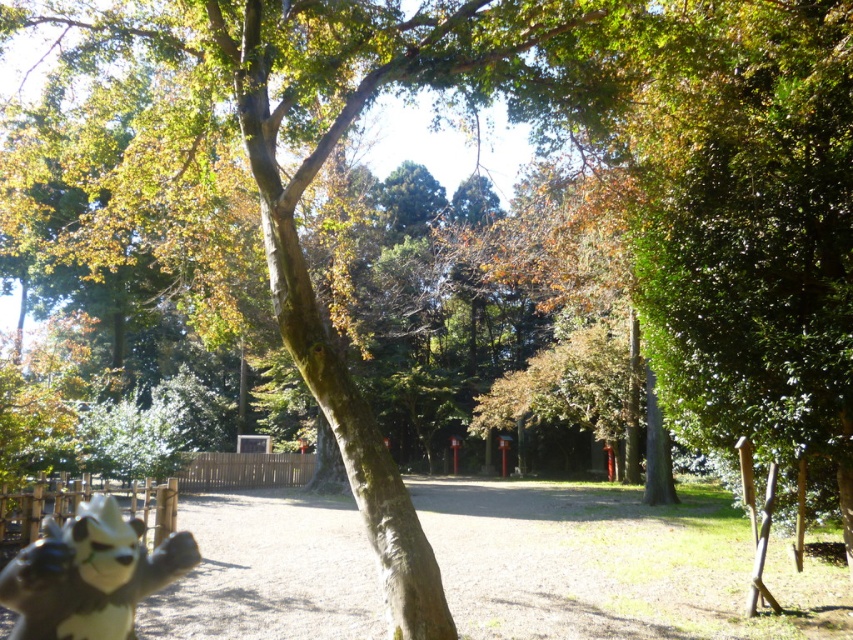
Question: Considering the relative positions of dirt ground at center and black and white fur statue at lower left in the image provided, where is dirt ground at center located with respect to black and white fur statue at lower left?

Choices:
 (A) left
 (B) right

Answer: (B)

Question: Is dirt ground at center positioned at the back of black and white fur statue at lower left?

Choices:
 (A) no
 (B) yes

Answer: (B)

Question: Can you confirm if dirt ground at center is wider than black and white fur statue at lower left?

Choices:
 (A) yes
 (B) no

Answer: (A)